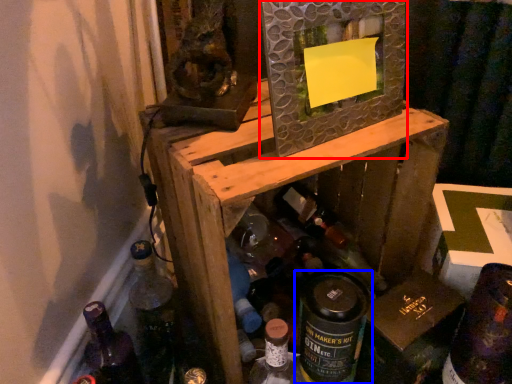
Question: Which object appears farthest to the camera in this image, picture frame (highlighted by a red box) or bottle (highlighted by a blue box)?

Choices:
 (A) picture frame
 (B) bottle

Answer: (B)